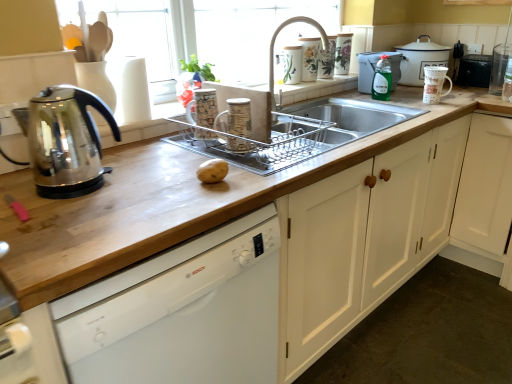
The height and width of the screenshot is (384, 512). Identify the location of free space in front of matte ceramic mug at upper center, which is the 6th appliance from right to left. (238, 163).